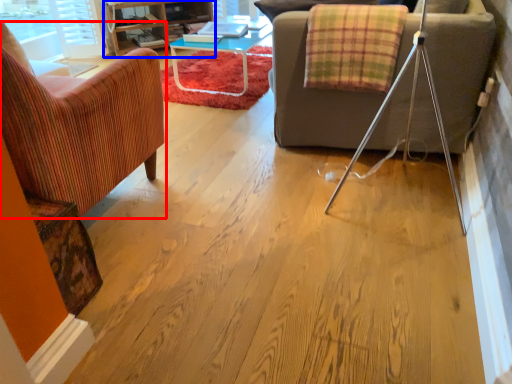
Question: Which of the following is the closest to the observer, chair (highlighted by a red box) or entertainment center (highlighted by a blue box)?

Choices:
 (A) chair
 (B) entertainment center

Answer: (A)